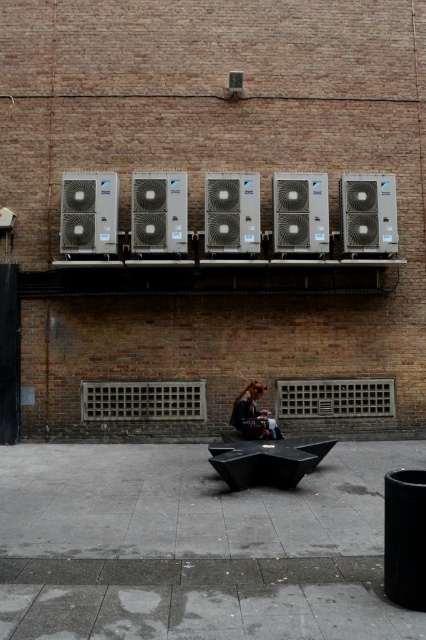
Question: Does silver metallic air conditioner at upper center appear on the left side of silver metallic air conditioner at center?

Choices:
 (A) yes
 (B) no

Answer: (A)

Question: Which point appears farthest from the camera in this image?

Choices:
 (A) (215, 179)
 (B) (249, 456)

Answer: (A)

Question: Does black matte park bench at center have a smaller size compared to silver metallic air conditioner at right?

Choices:
 (A) no
 (B) yes

Answer: (A)

Question: Is silver metallic air conditioner at upper center to the left of dark brown leather jacket at center from the viewer's perspective?

Choices:
 (A) no
 (B) yes

Answer: (B)

Question: Which point is farther to the camera?

Choices:
 (A) (229, 244)
 (B) (69, 246)
 (C) (233, 412)

Answer: (A)

Question: Which object is positioned farthest from the black matte park bench at center?

Choices:
 (A) silver metallic air conditioner at center
 (B) dark brown leather jacket at center

Answer: (A)